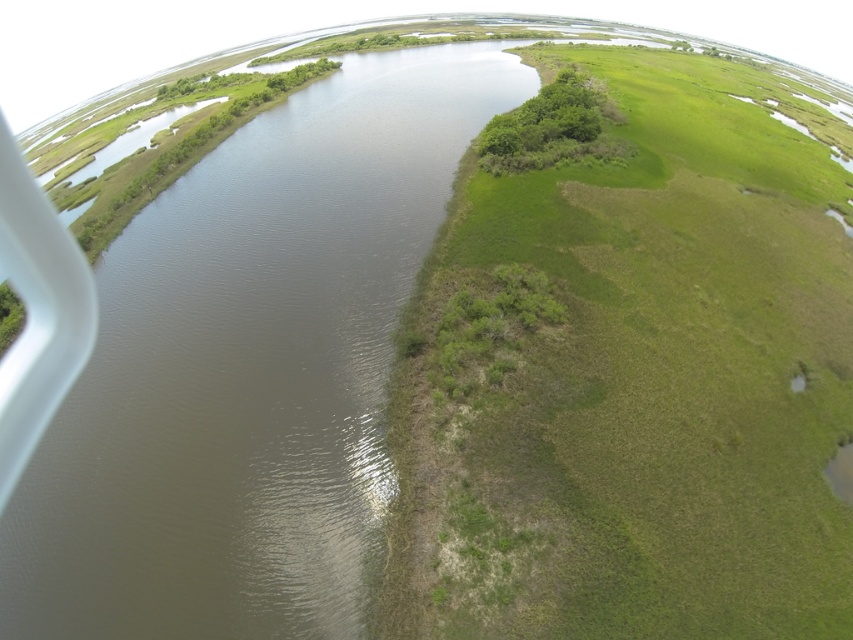
Is brown muddy water at center wider than white plastic airplane window at left?

Indeed, brown muddy water at center has a greater width compared to white plastic airplane window at left.

Does point (178, 204) come in front of point (0, 364)?

No, it is not.

At what (x,y) coordinates should I click in order to perform the action: click on brown muddy water at center. Please return your answer as a coordinate pair (x, y). Looking at the image, I should click on (248, 369).

Between green grassy patch at center-right and brown muddy water at center, which one has less height?

Standing shorter between the two is green grassy patch at center-right.

Who is higher up, green grassy patch at center-right or brown muddy water at center?

green grassy patch at center-right

The height and width of the screenshot is (640, 853). What do you see at coordinates (631, 378) in the screenshot? I see `green grassy patch at center-right` at bounding box center [631, 378].

Where is `green grassy patch at center-right`? green grassy patch at center-right is located at coordinates (631, 378).

Is green grassy patch at center-right wider than white plastic airplane window at left?

Yes, green grassy patch at center-right is wider than white plastic airplane window at left.

Is green grassy patch at center-right to the left of white plastic airplane window at left from the viewer's perspective?

In fact, green grassy patch at center-right is to the right of white plastic airplane window at left.

At what (x,y) coordinates should I click in order to perform the action: click on green grassy patch at center-right. Please return your answer as a coordinate pair (x, y). This screenshot has width=853, height=640. Looking at the image, I should click on (631, 378).